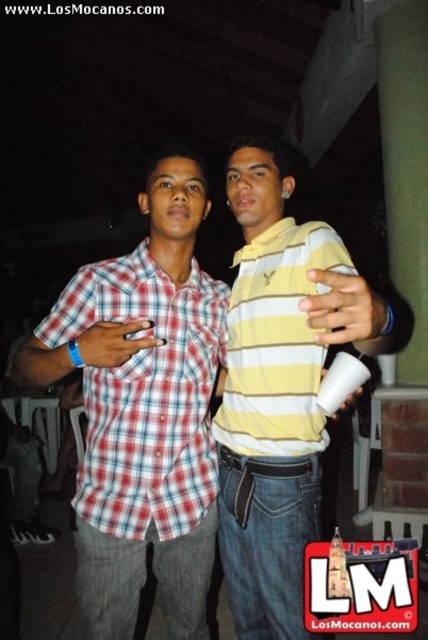
Question: In this image, where is red plaid shirt at center located relative to yellow striped polo at center?

Choices:
 (A) left
 (B) right

Answer: (A)

Question: Which point is farther from the camera taking this photo?

Choices:
 (A) (92, 611)
 (B) (323, 440)

Answer: (B)

Question: Which of the following is the closest to the observer?

Choices:
 (A) (183, 221)
 (B) (246, 513)

Answer: (B)

Question: Can you confirm if red plaid shirt at center is positioned to the left of yellow striped polo shirt at center?

Choices:
 (A) no
 (B) yes

Answer: (B)

Question: Can you confirm if red plaid shirt at center is positioned above yellow striped polo at center?

Choices:
 (A) yes
 (B) no

Answer: (B)

Question: Which object appears farthest from the camera in this image?

Choices:
 (A) red plaid shirt at center
 (B) yellow striped polo shirt at center

Answer: (A)